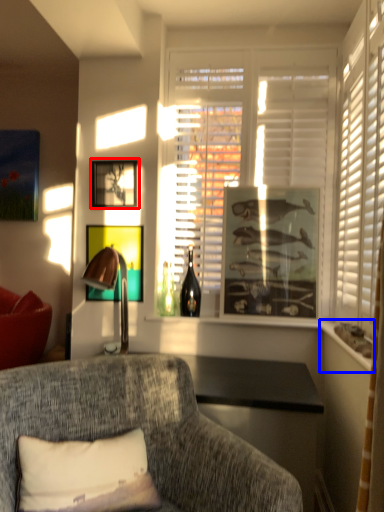
Question: Among these objects, which one is nearest to the camera, picture frame (highlighted by a red box) or window sill (highlighted by a blue box)?

Choices:
 (A) picture frame
 (B) window sill

Answer: (B)